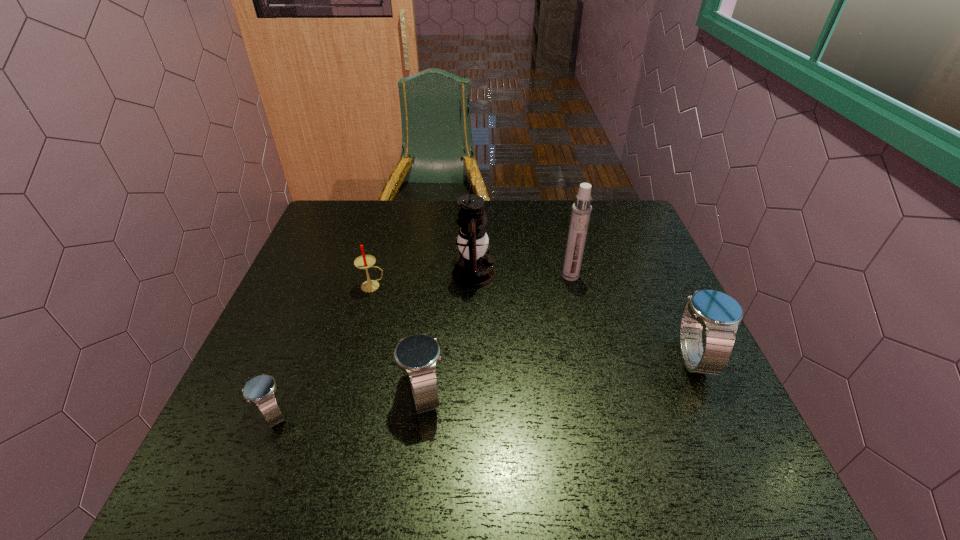
Locate an element on the screen. vacant area that lies between the second tallest watch and the aerosol can is located at coordinates (497, 335).

The width and height of the screenshot is (960, 540). I want to click on empty location between the second tallest watch and the rightmost object, so click(558, 375).

Where is `object identified as the fifth closest to the candle`? object identified as the fifth closest to the candle is located at coordinates (719, 314).

Locate an element on the screen. Image resolution: width=960 pixels, height=540 pixels. object that is the fourth nearest to the aerosol can is located at coordinates (365, 261).

Select which watch is the second closest to the aerosol can. Please provide its 2D coordinates. Your answer should be formatted as a tuple, i.e. [(x, y)], where the tuple contains the x and y coordinates of a point satisfying the conditions above.

[(417, 355)]

I want to click on the closest watch to the rightmost watch, so click(417, 355).

The image size is (960, 540). Identify the location of free space that satisfies the following two spatial constraints: 1. on the front side of the fifth object from right to left; 2. on the right side of the rightmost watch. (353, 357).

The height and width of the screenshot is (540, 960). What are the coordinates of `vacant position in the image that satisfies the following two spatial constraints: 1. on the side of the lantern, there is a wick adjustment knob; 2. on the right side of the aerosol can` in the screenshot? It's located at (474, 276).

At what (x,y) coordinates should I click in order to perform the action: click on free space in the image that satisfies the following two spatial constraints: 1. on the back side of the rightmost object; 2. on the side of the lantern, there is a wick adjustment knob. Please return your answer as a coordinate pair (x, y). Looking at the image, I should click on (654, 274).

Find the location of a particular element. blank space that satisfies the following two spatial constraints: 1. on the side of the lantern, there is a wick adjustment knob; 2. on the right side of the fifth object from left to right is located at coordinates (474, 276).